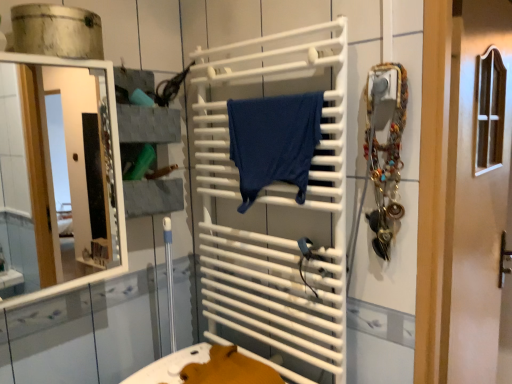
Question: From the image's perspective, relative to dark blue fabric at center, is white glossy door at center above or below?

Choices:
 (A) above
 (B) below

Answer: (B)

Question: From a real-world perspective, is white glossy door at center physically located above or below dark blue fabric at center?

Choices:
 (A) above
 (B) below

Answer: (B)

Question: Which object is positioned closest to the dark blue fabric at center?

Choices:
 (A) white glossy mirror at left
 (B) white glossy door at center
 (C) white matte towel rack at center
 (D) metallic silver jewelry at right

Answer: (C)

Question: Which of these objects is positioned closest to the white glossy mirror at left?

Choices:
 (A) white matte towel rack at center
 (B) metallic silver jewelry at right
 (C) white glossy door at center
 (D) dark blue fabric at center

Answer: (A)